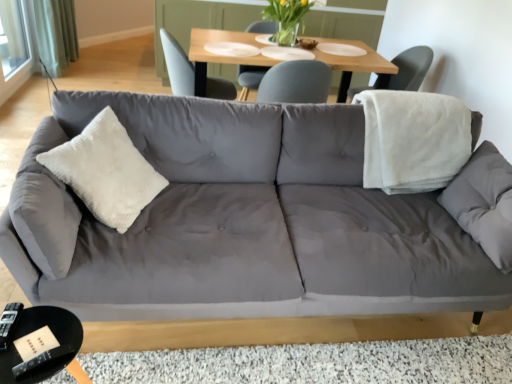
Question: Should I look upward or downward to see translucent glass vase at upper center?

Choices:
 (A) up
 (B) down

Answer: (A)

Question: Is wooden table at upper center completely or partially inside white fleece blanket at right?

Choices:
 (A) yes
 (B) no

Answer: (B)

Question: Can you confirm if white fleece blanket at right is bigger than wooden table at upper center?

Choices:
 (A) no
 (B) yes

Answer: (A)

Question: Is white fleece blanket at right positioned with its back to wooden table at upper center?

Choices:
 (A) no
 (B) yes

Answer: (B)

Question: Does white fleece blanket at right have a greater height compared to wooden table at upper center?

Choices:
 (A) no
 (B) yes

Answer: (B)

Question: Considering the relative sizes of white fleece blanket at right and wooden table at upper center in the image provided, is white fleece blanket at right wider than wooden table at upper center?

Choices:
 (A) yes
 (B) no

Answer: (B)

Question: Considering the relative sizes of white fleece blanket at right and wooden table at upper center in the image provided, is white fleece blanket at right smaller than wooden table at upper center?

Choices:
 (A) yes
 (B) no

Answer: (A)

Question: Can you confirm if black glossy coffee table at lower left is positioned to the left of wooden table at upper center?

Choices:
 (A) yes
 (B) no

Answer: (A)

Question: Is black glossy coffee table at lower left not within wooden table at upper center?

Choices:
 (A) no
 (B) yes

Answer: (B)

Question: From the image's perspective, is black glossy coffee table at lower left located above wooden table at upper center?

Choices:
 (A) yes
 (B) no

Answer: (B)

Question: Is wooden table at upper center inside black glossy coffee table at lower left?

Choices:
 (A) no
 (B) yes

Answer: (A)

Question: Is black glossy coffee table at lower left taller than wooden table at upper center?

Choices:
 (A) no
 (B) yes

Answer: (A)

Question: Is black glossy coffee table at lower left wider than wooden table at upper center?

Choices:
 (A) no
 (B) yes

Answer: (A)

Question: Does white fleece blanket at right have a lesser height compared to matte gray chair at upper center, which appears as the 2th chair when viewed from the right?

Choices:
 (A) no
 (B) yes

Answer: (B)